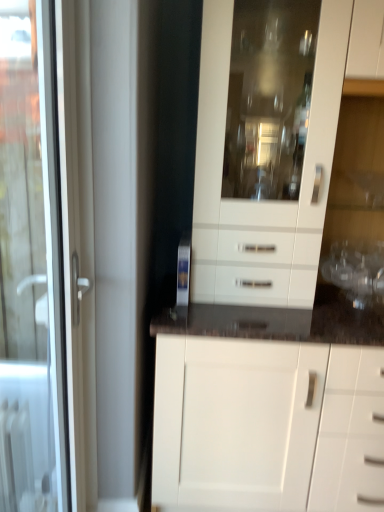
Image resolution: width=384 pixels, height=512 pixels. I want to click on white glossy door at left, so [x=46, y=258].

Looking at this image, measure the distance between white glossy door at left and camera.

3.60 feet.

The image size is (384, 512). Describe the element at coordinates (46, 258) in the screenshot. I see `white glossy door at left` at that location.

What is the approximate width of white glossy door at left?

2.82 inches.

Describe the element at coordinates (276, 278) in the screenshot. The height and width of the screenshot is (512, 384). I see `white glossy cabinet at center` at that location.

What is the approximate width of white glossy cabinet at center?

white glossy cabinet at center is 58.63 centimeters wide.

At what (x,y) coordinates should I click in order to perform the action: click on white glossy cabinet at center. Please return your answer as a coordinate pair (x, y). The height and width of the screenshot is (512, 384). Looking at the image, I should click on (276, 278).

At what (x,y) coordinates should I click in order to perform the action: click on white glossy door at left. Please return your answer as a coordinate pair (x, y). Image resolution: width=384 pixels, height=512 pixels. Looking at the image, I should click on (46, 258).

Which is more to the right, white glossy cabinet at center or white glossy door at left?

white glossy cabinet at center.

In the scene shown: Does white glossy cabinet at center come in front of white glossy door at left?

No, white glossy cabinet at center is behind white glossy door at left.

Is point (291, 448) less distant than point (15, 295)?

Yes, it is.

From the image's perspective, which is below, white glossy cabinet at center or white glossy door at left?

white glossy door at left is shown below in the image.

Looking at this image, from a real-world perspective, who is located higher, white glossy cabinet at center or white glossy door at left?

white glossy cabinet at center is physically above.

Does white glossy cabinet at center have a greater width compared to white glossy door at left?

Correct, the width of white glossy cabinet at center exceeds that of white glossy door at left.

Can you confirm if white glossy cabinet at center is shorter than white glossy door at left?

No.

Considering the sizes of objects white glossy cabinet at center and white glossy door at left in the image provided, who is bigger, white glossy cabinet at center or white glossy door at left?

With larger size is white glossy cabinet at center.

Is white glossy door at left inside white glossy cabinet at center?

No.

Consider the image. Is white glossy cabinet at center placed right next to white glossy door at left?

No, white glossy cabinet at center is not beside white glossy door at left.

Is white glossy cabinet at center positioned with its back to white glossy door at left?

white glossy cabinet at center does not have its back to white glossy door at left.

Can you tell me how much white glossy cabinet at center and white glossy door at left differ in facing direction?

89 degrees.

Identify the location of door below the white glossy cabinet at center (from the image's perspective). The width and height of the screenshot is (384, 512). (46, 258).

Is white glossy door at left at the right side of white glossy cabinet at center?

Incorrect, white glossy door at left is not on the right side of white glossy cabinet at center.

Is white glossy door at left positioned before white glossy cabinet at center?

Yes, the depth of white glossy door at left is less than that of white glossy cabinet at center.

Is point (2, 322) positioned before point (348, 272)?

No, it is not.

From the image's perspective, is white glossy door at left above or below white glossy cabinet at center?

Based on their image positions, white glossy door at left is located beneath white glossy cabinet at center.

From a real-world perspective, which object rests below the other?

white glossy door at left is physically lower.

Which of these two, white glossy door at left or white glossy cabinet at center, is thinner?

With smaller width is white glossy door at left.

Which of these two, white glossy door at left or white glossy cabinet at center, stands taller?

white glossy cabinet at center.

Between white glossy door at left and white glossy cabinet at center, which one has larger size?

white glossy cabinet at center is bigger.

Does white glossy door at left contain white glossy cabinet at center?

No, white glossy door at left does not contain white glossy cabinet at center.

Are white glossy door at left and white glossy cabinet at center located far from each other?

No, white glossy door at left is not far from white glossy cabinet at center.

Is white glossy cabinet at center at the back of white glossy door at left?

white glossy door at left is not turned away from white glossy cabinet at center.

Find the location of a particular element. cabinetry that is behind the white glossy door at left is located at coordinates (276, 278).

Locate an element on the screen. This screenshot has width=384, height=512. door below the white glossy cabinet at center (from the image's perspective) is located at coordinates (46, 258).

Locate an element on the screen. This screenshot has width=384, height=512. cabinetry lying on the right of white glossy door at left is located at coordinates (276, 278).